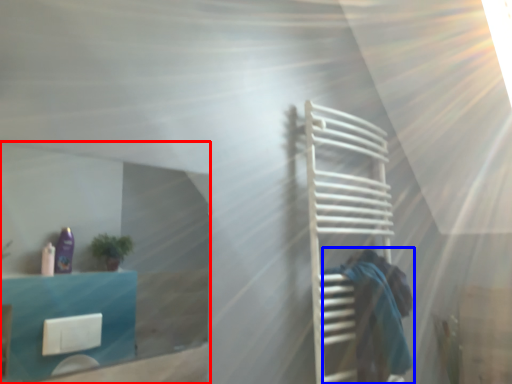
Question: Which object appears farthest to the camera in this image, glass door (highlighted by a red box) or person (highlighted by a blue box)?

Choices:
 (A) glass door
 (B) person

Answer: (B)